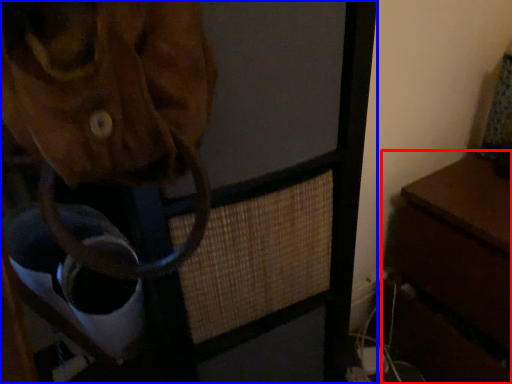
Question: Which object is closer to the camera taking this photo, table (highlighted by a red box) or furniture (highlighted by a blue box)?

Choices:
 (A) table
 (B) furniture

Answer: (B)